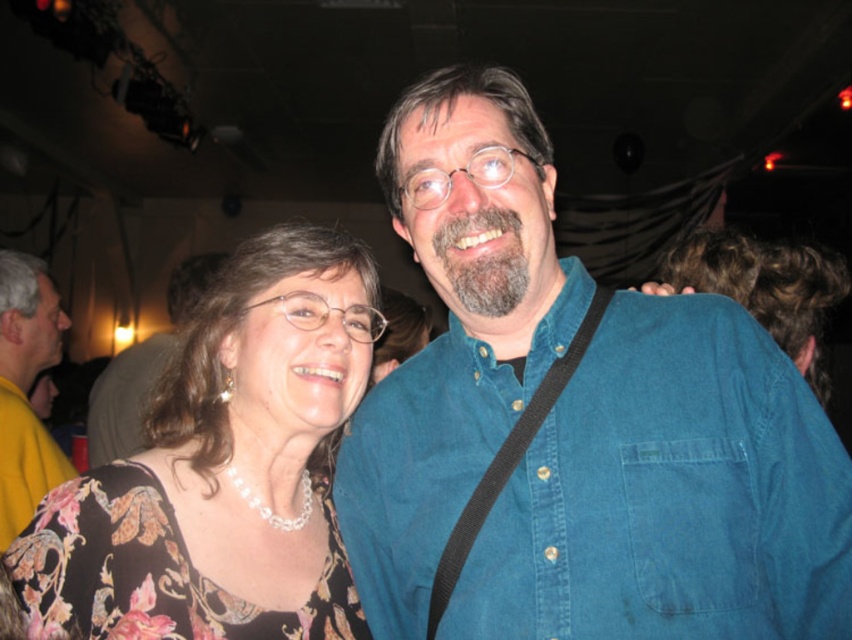
Question: Estimate the real-world distances between objects in this image. Which object is closer to the matte black shirt at center?

Choices:
 (A) yellow/yellowish fabric at left
 (B) blue denim shirt at center

Answer: (A)

Question: Can you confirm if yellow/yellowish fabric at left is positioned to the left of matte black shirt at center?

Choices:
 (A) yes
 (B) no

Answer: (B)

Question: Which object appears farthest from the camera in this image?

Choices:
 (A) blue denim shirt at center
 (B) floral-patterned blouse at left
 (C) matte black shirt at center
 (D) yellow/yellowish fabric at left

Answer: (C)

Question: From the image, what is the correct spatial relationship of yellow/yellowish fabric at left in relation to matte black shirt at center?

Choices:
 (A) below
 (B) above

Answer: (A)

Question: Can you confirm if floral-patterned blouse at left is positioned above matte black shirt at center?

Choices:
 (A) yes
 (B) no

Answer: (B)

Question: Among these points, which one is nearest to the camera?

Choices:
 (A) (235, 598)
 (B) (43, 310)
 (C) (125, 445)

Answer: (A)